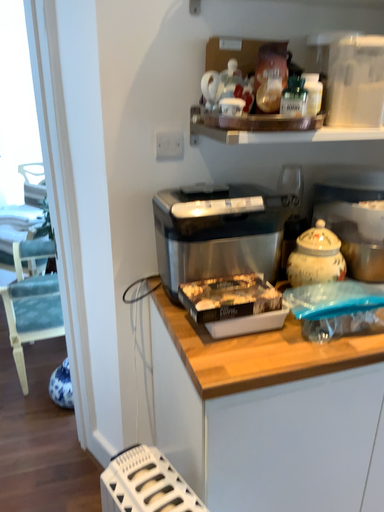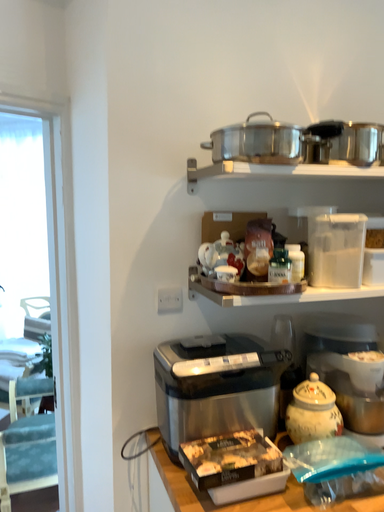
Question: Which way did the camera rotate in the video?

Choices:
 (A) rotated downward
 (B) rotated upward

Answer: (B)